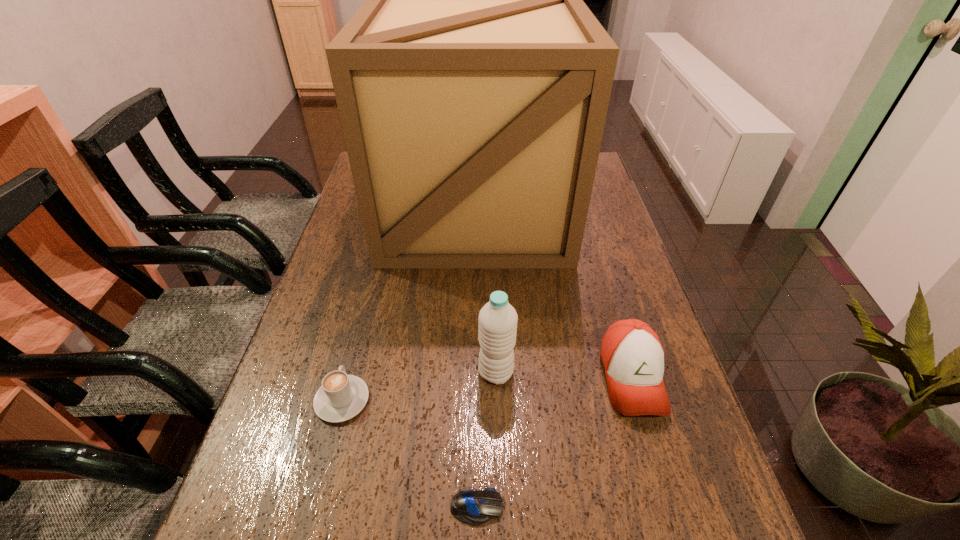
At what (x,y) coordinates should I click in order to perform the action: click on free area in between the baseball cap and the shortest object. Please return your answer as a coordinate pair (x, y). This screenshot has height=540, width=960. Looking at the image, I should click on (554, 442).

At what (x,y) coordinates should I click in order to perform the action: click on vacant point located between the third shortest object and the cappuccino. Please return your answer as a coordinate pair (x, y). Looking at the image, I should click on (487, 389).

Image resolution: width=960 pixels, height=540 pixels. Identify the location of vacant area between the shortest object and the fourth shortest object. (487, 440).

Choose which object is the fourth nearest neighbor to the computer mouse. Please provide its 2D coordinates. Your answer should be formatted as a tuple, i.e. [(x, y)], where the tuple contains the x and y coordinates of a point satisfying the conditions above.

[(473, 84)]

Find the location of a particular element. The image size is (960, 540). object that is the third closest one to the fourth shortest object is located at coordinates (340, 397).

Locate an element on the screen. The width and height of the screenshot is (960, 540). vacant region that satisfies the following two spatial constraints: 1. on the front-facing side of the baseball cap; 2. on the button side of the computer mouse is located at coordinates (670, 507).

This screenshot has height=540, width=960. Identify the location of vacant space that satisfies the following two spatial constraints: 1. to the right of the fourth tallest object; 2. on the left side of the second tallest object. (349, 373).

Identify the location of vacant space that satisfies the following two spatial constraints: 1. on the reinforced sides of the box; 2. on the left side of the second tallest object. Image resolution: width=960 pixels, height=540 pixels. (473, 373).

You are a GUI agent. You are given a task and a screenshot of the screen. Output one action in this format:
    pyautogui.click(x=<x>, y=<y>)
    Task: Click on the vacant point that satisfies the following two spatial constraints: 1. to the right of the second shortest object; 2. on the left side of the second tallest object
    Image resolution: width=960 pixels, height=540 pixels.
    Given the screenshot: What is the action you would take?
    pyautogui.click(x=349, y=373)

At what (x,y) coordinates should I click in order to perform the action: click on free space that satisfies the following two spatial constraints: 1. on the reinforced sides of the second tallest object; 2. on the left side of the box. Please return your answer as a coordinate pair (x, y). This screenshot has width=960, height=540. Looking at the image, I should click on (473, 373).